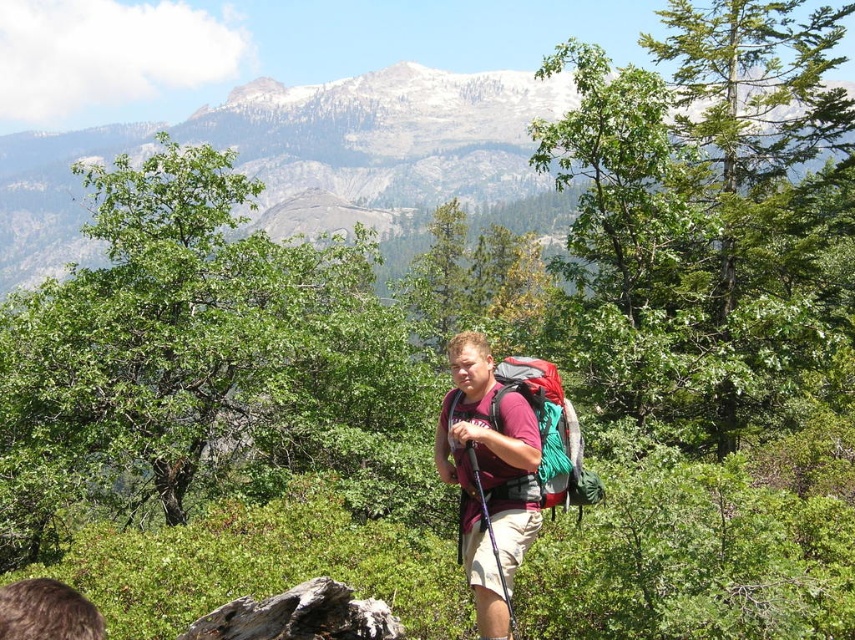
You are a hiker planning to take a photo of the snowy granite mountain at upper center and the matte red shirt at center. Based on their sizes in the image, which object would appear larger in your photo?

The snowy granite mountain at upper center might appear larger than the matte red shirt at center in the photo because it is described as possibly being wider.

You are a hiker in the forest and want to ensure your clothing and gear are visible to others for safety. Which item, the matte red shirt at center or the matte red backpack at center, is more likely to be noticed by someone passing by due to its size?

The matte red backpack at center is larger than the matte red shirt at center, so it would be more noticeable to someone passing by.

You are a hiker in a forest and you notice two red items at the center of your view. Which one is shorter, the matte red shirt at center or the matte red backpack at center?

The matte red shirt at center is shorter than the matte red backpack at center.